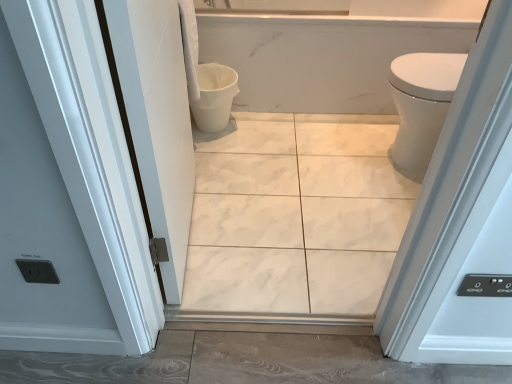
Find the location of a particular element. This screenshot has height=384, width=512. free space to the back side of white glossy door at left is located at coordinates (225, 180).